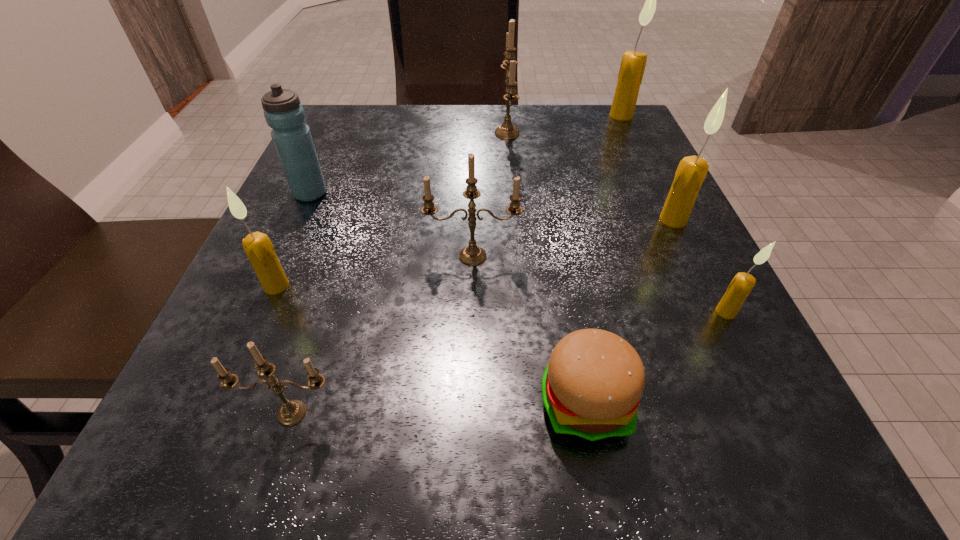
Locate which cream candle is the third closest to the seventh nearest object. Please provide its 2D coordinates. Your answer should be formatted as a tuple, i.e. [(x, y)], where the tuple contains the x and y coordinates of a point satisfying the conditions above.

[(633, 63)]

I want to click on cream candle that can be found as the third closest to the fifth farthest object, so click(742, 284).

Identify the location of metallic candle that is the second closest to the second nearest candle. (507, 130).

In order to click on the closest metallic candle to the farthest metallic candle in this screenshot , I will do `click(472, 255)`.

The height and width of the screenshot is (540, 960). Identify the location of blank area in the image that satisfies the following two spatial constraints: 1. on the front side of the tallest candle; 2. on the right side of the sixth farthest candle. (715, 312).

Find the location of a particular element. This screenshot has width=960, height=540. vacant position in the image that satisfies the following two spatial constraints: 1. on the front side of the second farthest metallic candle; 2. on the right side of the hamburger is located at coordinates [470, 403].

In order to click on free point that satisfies the following two spatial constraints: 1. on the front side of the fifth farthest candle; 2. on the right side of the beige hamburger in this screenshot , I will do `click(226, 403)`.

Where is `free region that satisfies the following two spatial constraints: 1. on the back side of the fifth farthest object; 2. on the left side of the leftmost metallic candle`? The height and width of the screenshot is (540, 960). free region that satisfies the following two spatial constraints: 1. on the back side of the fifth farthest object; 2. on the left side of the leftmost metallic candle is located at coordinates (342, 256).

Where is `vacant space that satisfies the following two spatial constraints: 1. on the back side of the fourth farthest object; 2. on the right side of the fourth nearest candle`? The height and width of the screenshot is (540, 960). vacant space that satisfies the following two spatial constraints: 1. on the back side of the fourth farthest object; 2. on the right side of the fourth nearest candle is located at coordinates point(473,220).